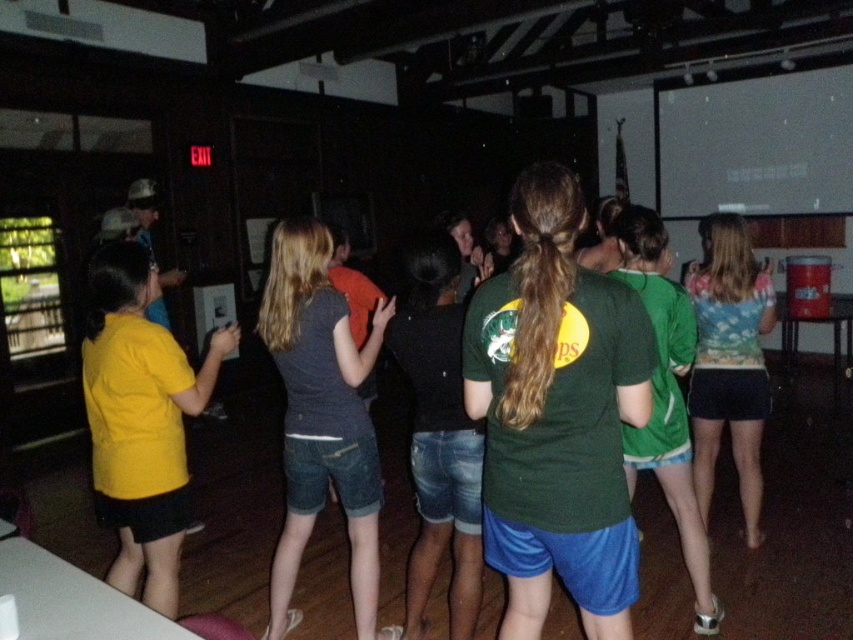
Question: Which object is the farthest from the green jersey at center?

Choices:
 (A) yellow matte shirt at left
 (B) printed cotton shirt at center
 (C) dark gray denim shorts at center

Answer: (A)

Question: Can you confirm if green matte t-shirt at center is thinner than green jersey at center?

Choices:
 (A) no
 (B) yes

Answer: (B)

Question: Is green matte t-shirt at center above dark gray denim shorts at center?

Choices:
 (A) yes
 (B) no

Answer: (A)

Question: Which of these objects is positioned closest to the yellow matte shirt at left?

Choices:
 (A) dark gray denim shorts at center
 (B) green matte t-shirt at center
 (C) printed cotton shirt at center
 (D) green jersey at center

Answer: (A)

Question: Which point is closer to the camera?

Choices:
 (A) printed cotton shirt at center
 (B) green jersey at center
 (C) green matte t-shirt at center

Answer: (C)

Question: Does dark gray denim shorts at center come behind printed cotton shirt at center?

Choices:
 (A) no
 (B) yes

Answer: (A)